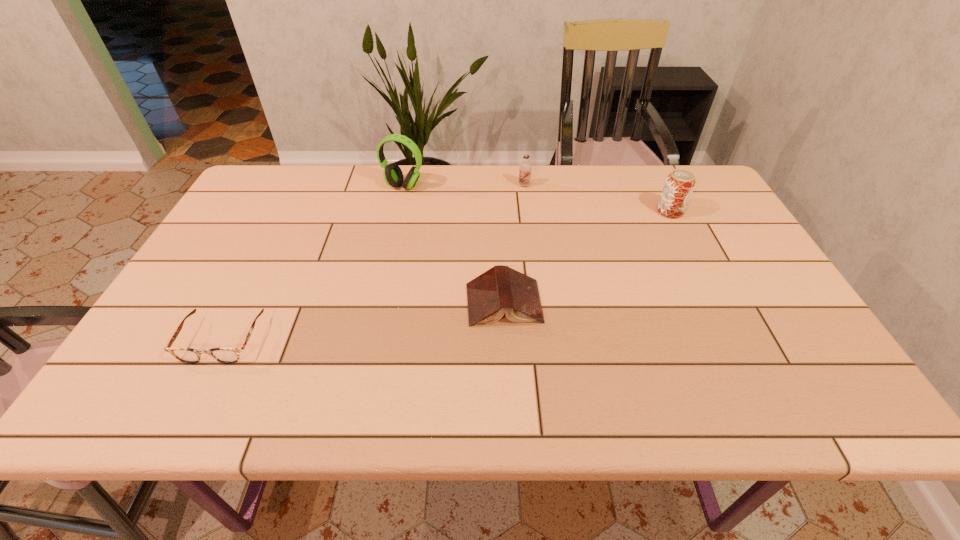
This screenshot has width=960, height=540. I want to click on free point between the second shortest object and the third farthest object, so click(x=587, y=258).

I want to click on free space between the book and the third nearest object, so click(587, 258).

Where is `free space between the shortest object and the tallest object`? This screenshot has width=960, height=540. free space between the shortest object and the tallest object is located at coordinates (313, 263).

Image resolution: width=960 pixels, height=540 pixels. In order to click on free space between the beer can and the spectacles in this screenshot , I will do `click(446, 275)`.

Locate which object ranks second in proximity to the chocolate milk. Please provide its 2D coordinates. Your answer should be formatted as a tuple, i.e. [(x, y)], where the tuple contains the x and y coordinates of a point satisfying the conditions above.

[(679, 185)]

You are a GUI agent. You are given a task and a screenshot of the screen. Output one action in this format:
    pyautogui.click(x=<x>, y=<y>)
    Task: Click on the third closest object to the book
    The height and width of the screenshot is (540, 960).
    Given the screenshot: What is the action you would take?
    pyautogui.click(x=679, y=185)

Where is `free space that satisfies the following two spatial constraints: 1. on the back side of the tallest object; 2. on the right side of the chocolate milk`? The width and height of the screenshot is (960, 540). free space that satisfies the following two spatial constraints: 1. on the back side of the tallest object; 2. on the right side of the chocolate milk is located at coordinates (403, 185).